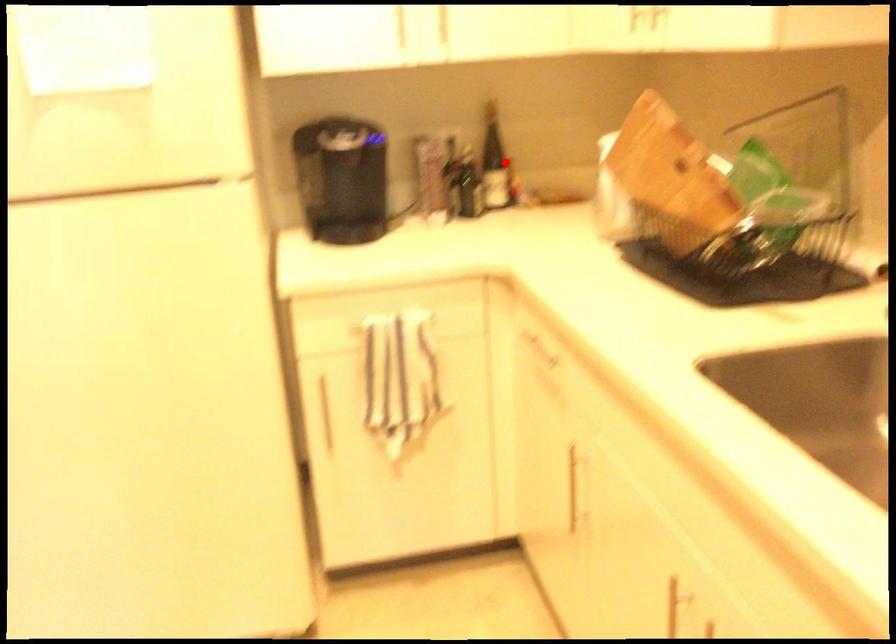
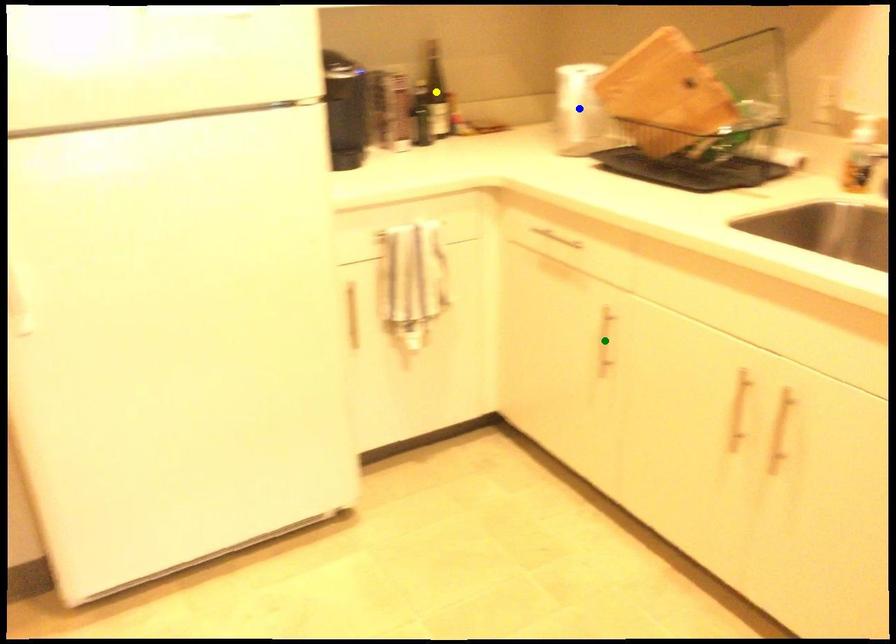
Question: I am providing you with two images of the same scene from different viewpoints. A red point is marked on the first image. You are given multiple points on the second image. Which point in image 2 represents the same 3d spot as the red point in image 1?

Choices:
 (A) yellow point
 (B) blue point
 (C) green point

Answer: (A)